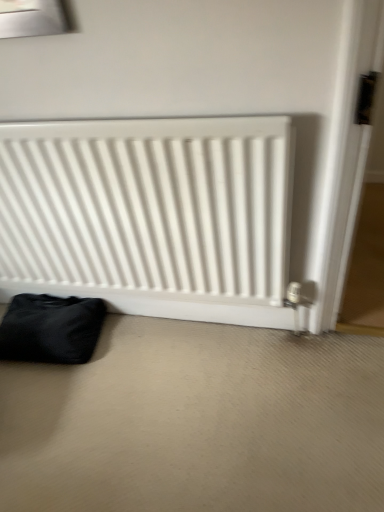
Question: Is white matte radiator at center inside or outside of black fabric bag at lower left?

Choices:
 (A) outside
 (B) inside

Answer: (A)

Question: From the image's perspective, is white matte radiator at center above or below black fabric bag at lower left?

Choices:
 (A) below
 (B) above

Answer: (B)

Question: From a real-world perspective, is white matte radiator at center positioned above or below black fabric bag at lower left?

Choices:
 (A) above
 (B) below

Answer: (A)

Question: Would you say black fabric bag at lower left is inside or outside white matte radiator at center?

Choices:
 (A) inside
 (B) outside

Answer: (B)

Question: From their relative heights in the image, would you say black fabric bag at lower left is taller or shorter than white matte radiator at center?

Choices:
 (A) tall
 (B) short

Answer: (B)

Question: In terms of width, does black fabric bag at lower left look wider or thinner when compared to white matte radiator at center?

Choices:
 (A) thin
 (B) wide

Answer: (B)

Question: Considering the relative positions of black fabric bag at lower left and white matte radiator at center in the image provided, is black fabric bag at lower left to the left or to the right of white matte radiator at center?

Choices:
 (A) left
 (B) right

Answer: (A)